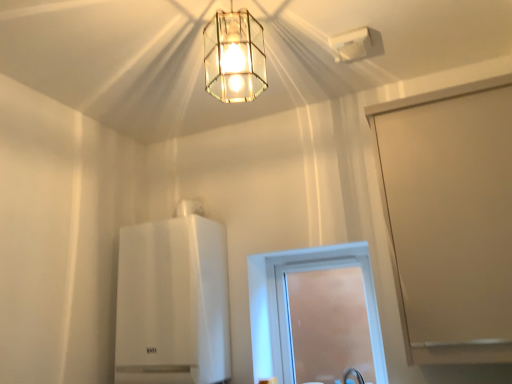
Question: Is clear glass window at center further to the viewer compared to white plastic air vent at upper center, placed as the second lamp when sorted from front to back?

Choices:
 (A) no
 (B) yes

Answer: (B)

Question: Can you confirm if clear glass window at center is shorter than white plastic air vent at upper center, which is the first lamp from back to front?

Choices:
 (A) yes
 (B) no

Answer: (B)

Question: Is white plastic air vent at upper center, placed as the second lamp when sorted from front to back, a part of clear glass window at center?

Choices:
 (A) no
 (B) yes

Answer: (A)

Question: Does clear glass window at center have a greater height compared to white plastic air vent at upper center, placed as the 1th lamp when sorted from right to left?

Choices:
 (A) yes
 (B) no

Answer: (A)

Question: Are clear glass window at center and white plastic air vent at upper center, which is the first lamp from back to front, far apart?

Choices:
 (A) yes
 (B) no

Answer: (A)

Question: In the image, is white plastic air vent at upper center, arranged as the 2th lamp when viewed from the left, positioned in front of or behind beige matte screen door at right?

Choices:
 (A) front
 (B) behind

Answer: (B)

Question: From the image's perspective, relative to beige matte screen door at right, is white plastic air vent at upper center, placed as the second lamp when sorted from front to back, above or below?

Choices:
 (A) above
 (B) below

Answer: (A)

Question: Is white plastic air vent at upper center, which is the first lamp from back to front, bigger or smaller than beige matte screen door at right?

Choices:
 (A) small
 (B) big

Answer: (A)

Question: Visually, is white plastic air vent at upper center, which is the first lamp from back to front, positioned to the left or to the right of beige matte screen door at right?

Choices:
 (A) right
 (B) left

Answer: (B)

Question: From a real-world perspective, is white glossy boiler at center physically located above or below white plastic air vent at upper center, placed as the 1th lamp when sorted from right to left?

Choices:
 (A) above
 (B) below

Answer: (B)

Question: In terms of height, does white glossy boiler at center look taller or shorter compared to white plastic air vent at upper center, which is the first lamp from back to front?

Choices:
 (A) short
 (B) tall

Answer: (B)

Question: Relative to white plastic air vent at upper center, placed as the second lamp when sorted from front to back, is white glossy boiler at center in front or behind?

Choices:
 (A) front
 (B) behind

Answer: (B)

Question: Would you say white glossy boiler at center is to the left or to the right of white plastic air vent at upper center, placed as the 1th lamp when sorted from right to left, in the picture?

Choices:
 (A) right
 (B) left

Answer: (B)

Question: Is white plastic air vent at upper center, which is the first lamp from back to front, inside or outside of clear glass pendant light at upper center, placed as the 2th lamp when sorted from right to left?

Choices:
 (A) outside
 (B) inside

Answer: (A)

Question: From a real-world perspective, is white plastic air vent at upper center, arranged as the 2th lamp when viewed from the left, above or below clear glass pendant light at upper center, placed as the first lamp when sorted from left to right?

Choices:
 (A) below
 (B) above

Answer: (B)